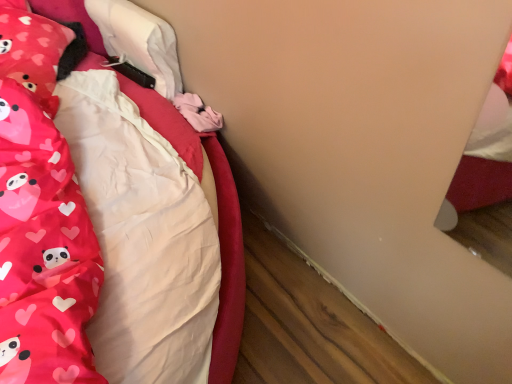
Question: Should I look upward or downward to see matte pink pillow at upper left?

Choices:
 (A) down
 (B) up

Answer: (B)